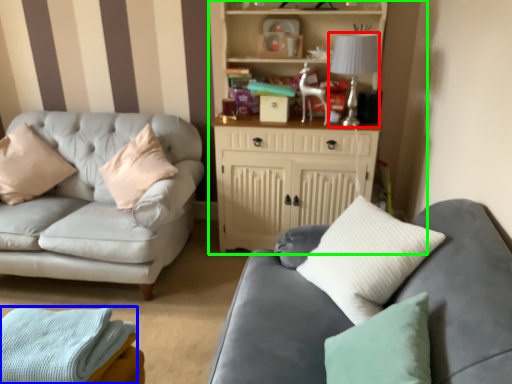
Question: Considering the real-world distances, which object is closest to lamp (highlighted by a red box)? material (highlighted by a blue box) or entertainment center (highlighted by a green box).

Choices:
 (A) material
 (B) entertainment center

Answer: (B)